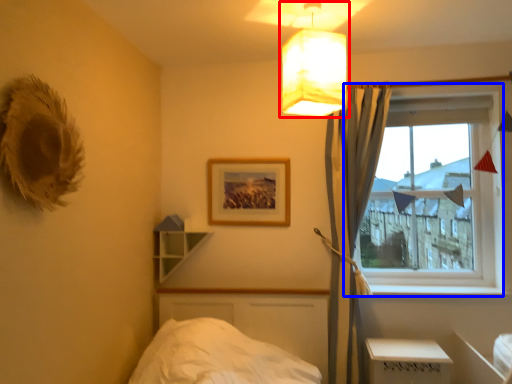
Question: Which of the following is the farthest to the observer, lamp (highlighted by a red box) or window (highlighted by a blue box)?

Choices:
 (A) lamp
 (B) window

Answer: (B)